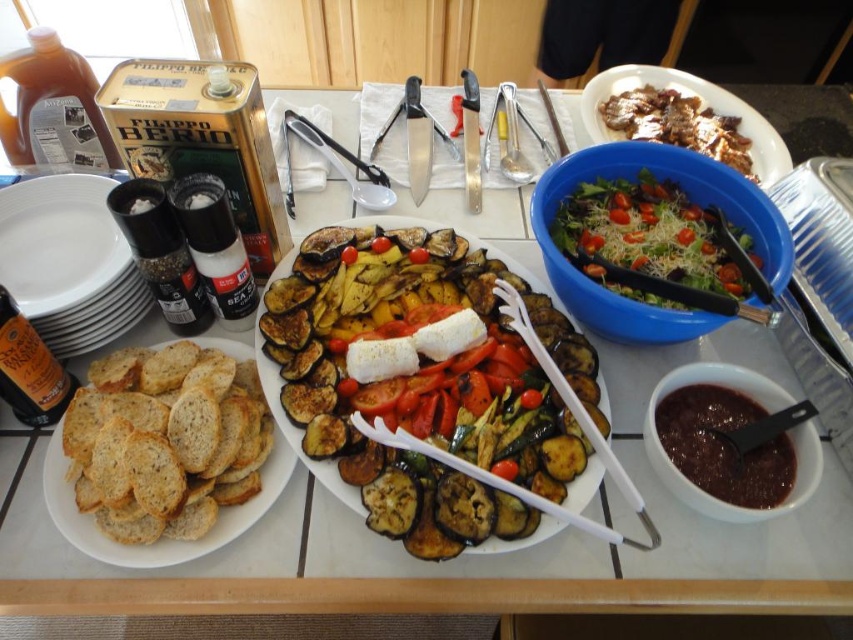
You are a food critic evaluating this table setting. You need to compare the height of the brown crumbly bread at left and the green leafy salad at upper right. Which one is taller?

The brown crumbly bread at left has a lesser height compared to the green leafy salad at upper right, so the green leafy salad at upper right is taller.

You are a guest at a dinner party and want to reach the grilled vegetables at center on the plate. There is a blue plastic bowl at upper right in the way. Can you move the bowl to access the vegetables?

The blue plastic bowl at upper right is positioned over grilled vegetables at center, so you can move the bowl to access the vegetables.

What is the coordinate of the blue plastic bowl at upper right?

The blue plastic bowl at upper right is located at coordinate point (688,196).